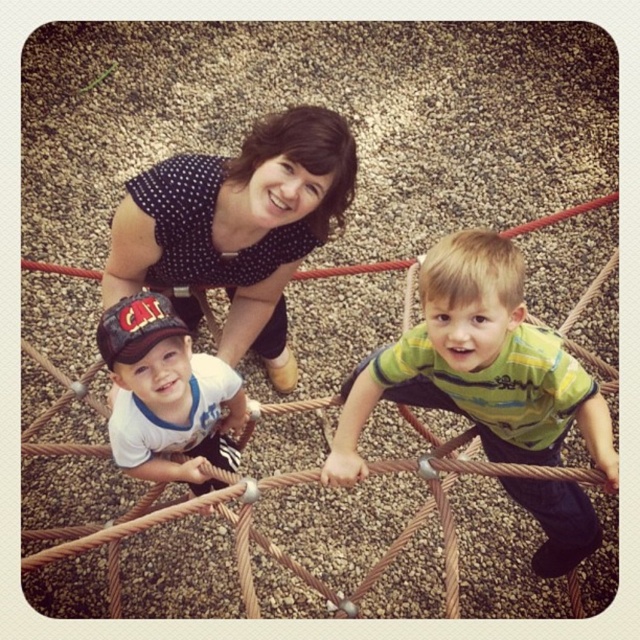
Between brown rope bridge at center and matte black cap at center, which one appears on the right side from the viewer's perspective?

brown rope bridge at center

Is point (49, 408) more distant than point (140, 310)?

That is True.

This screenshot has width=640, height=640. Find the location of `brown rope bridge at center`. brown rope bridge at center is located at coordinates (422, 518).

Is green striped shirt at center to the left of polka dot fabric at upper center from the viewer's perspective?

Incorrect, green striped shirt at center is not on the left side of polka dot fabric at upper center.

Identify the location of green striped shirt at center. (477, 365).

Find the location of a particular element. Image resolution: width=640 pixels, height=640 pixels. green striped shirt at center is located at coordinates (477, 365).

Which of these two, green striped shirt at center or brown rope bridge at center, stands shorter?

With less height is brown rope bridge at center.

Does green striped shirt at center appear over brown rope bridge at center?

Yes.

Between point (554, 403) and point (582, 474), which one is positioned behind?

Point (554, 403)

Find the location of a particular element. This screenshot has height=640, width=640. green striped shirt at center is located at coordinates (477, 365).